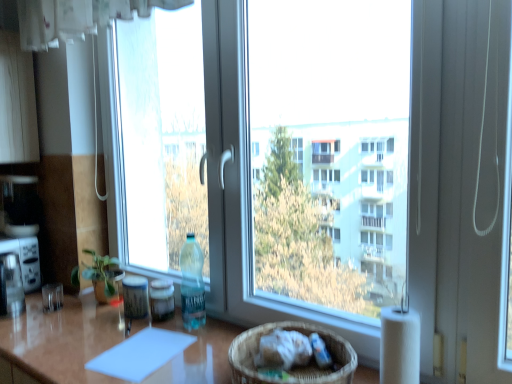
Question: Does translucent plastic bottle at center have a lesser height compared to woven brown basket at lower center?

Choices:
 (A) yes
 (B) no

Answer: (B)

Question: Is translucent plastic bottle at center aimed at woven brown basket at lower center?

Choices:
 (A) yes
 (B) no

Answer: (B)

Question: Does translucent plastic bottle at center have a smaller size compared to woven brown basket at lower center?

Choices:
 (A) yes
 (B) no

Answer: (A)

Question: Is translucent plastic bottle at center not close to woven brown basket at lower center?

Choices:
 (A) yes
 (B) no

Answer: (B)

Question: Does translucent plastic bottle at center have a greater height compared to woven brown basket at lower center?

Choices:
 (A) no
 (B) yes

Answer: (B)

Question: In the image, is white plastic toaster at left positioned in front of or behind translucent plastic bottle at center?

Choices:
 (A) front
 (B) behind

Answer: (B)

Question: From a real-world perspective, is white plastic toaster at left positioned above or below translucent plastic bottle at center?

Choices:
 (A) above
 (B) below

Answer: (A)

Question: Based on their positions, is white plastic toaster at left located to the left or right of translucent plastic bottle at center?

Choices:
 (A) right
 (B) left

Answer: (B)

Question: From their relative heights in the image, would you say white plastic toaster at left is taller or shorter than translucent plastic bottle at center?

Choices:
 (A) tall
 (B) short

Answer: (A)

Question: Is green matte plant at left spatially inside white paper at right, or outside of it?

Choices:
 (A) inside
 (B) outside

Answer: (B)

Question: Considering the positions of green matte plant at left and white paper at right in the image, is green matte plant at left taller or shorter than white paper at right?

Choices:
 (A) tall
 (B) short

Answer: (B)

Question: Considering the positions of green matte plant at left and white paper at right in the image, is green matte plant at left bigger or smaller than white paper at right?

Choices:
 (A) big
 (B) small

Answer: (A)

Question: Considering the positions of point (96, 294) and point (381, 380), is point (96, 294) closer or farther from the camera than point (381, 380)?

Choices:
 (A) closer
 (B) farther

Answer: (B)

Question: Is transparent glass window at center taller or shorter than white paper at right?

Choices:
 (A) short
 (B) tall

Answer: (B)

Question: In the image, is transparent glass window at center positioned in front of or behind white paper at right?

Choices:
 (A) behind
 (B) front

Answer: (B)